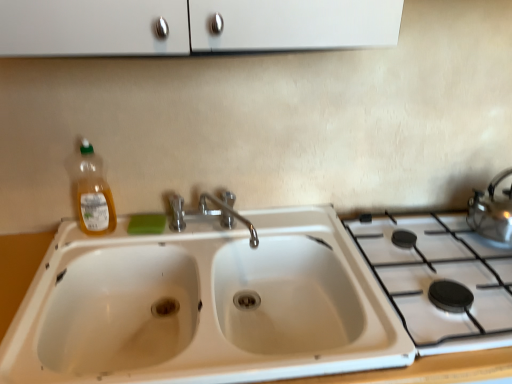
Find the location of `free space to the left of green matte soap at center`. free space to the left of green matte soap at center is located at coordinates (96, 238).